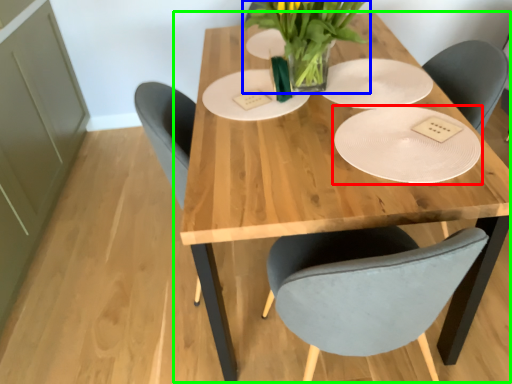
Question: Which object is positioned closest to plate (highlighted by a red box)? Select from floral arrangement (highlighted by a blue box) and table (highlighted by a green box).

Choices:
 (A) floral arrangement
 (B) table

Answer: (B)